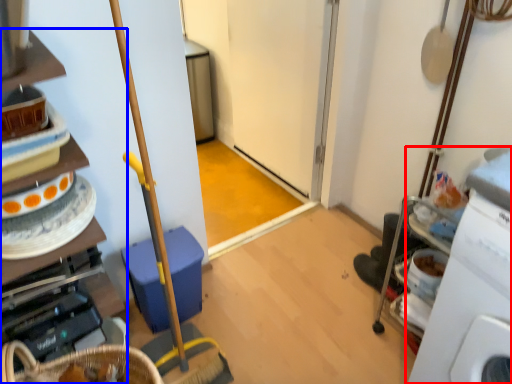
Question: Which object is further to the camera taking this photo, machine (highlighted by a red box) or cabinetry (highlighted by a blue box)?

Choices:
 (A) machine
 (B) cabinetry

Answer: (B)